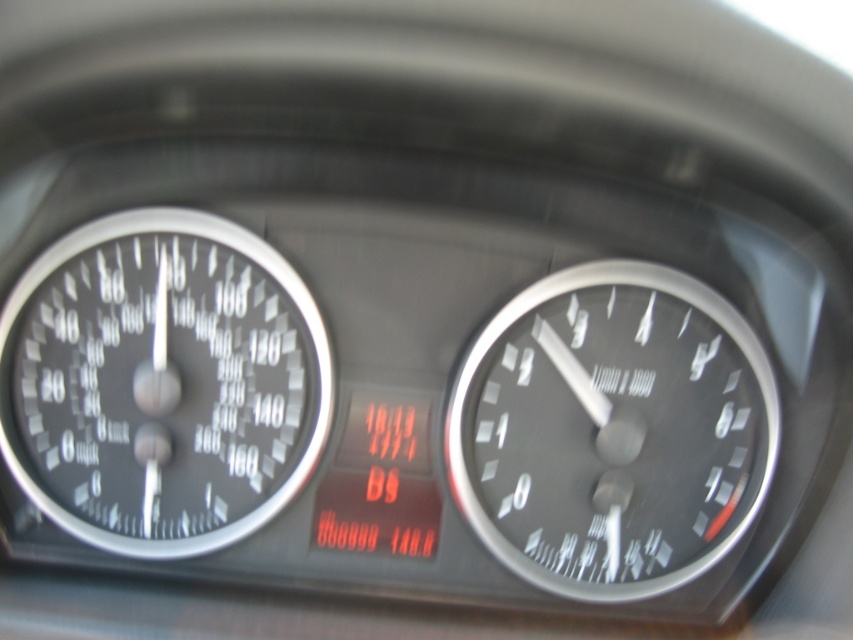
Question: Is matte black speedometer at left bigger than black metallic speedometer at right?

Choices:
 (A) no
 (B) yes

Answer: (A)

Question: Can you confirm if matte black speedometer at left is smaller than black metallic speedometer at right?

Choices:
 (A) no
 (B) yes

Answer: (B)

Question: Which point is closer to the camera?

Choices:
 (A) matte black speedometer at left
 (B) black metallic speedometer at right

Answer: (A)

Question: Which object is closer to the camera taking this photo?

Choices:
 (A) black metallic speedometer at right
 (B) matte black speedometer at left

Answer: (B)

Question: Among these points, which one is nearest to the camera?

Choices:
 (A) (165, 291)
 (B) (663, 348)

Answer: (A)

Question: Does matte black speedometer at left have a larger size compared to black metallic speedometer at right?

Choices:
 (A) no
 (B) yes

Answer: (A)